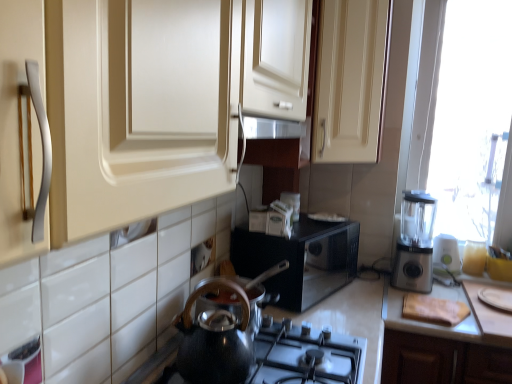
Describe the element at coordinates (447, 252) in the screenshot. The height and width of the screenshot is (384, 512). I see `white plastic blender at right, which is counted as the second appliance, starting from the left` at that location.

Image resolution: width=512 pixels, height=384 pixels. In order to click on shiny black kettle at lower center in this screenshot , I will do `click(305, 356)`.

The image size is (512, 384). What do you see at coordinates (415, 243) in the screenshot?
I see `silver metallic blender at right` at bounding box center [415, 243].

In order to face black glossy kettle at lower center, should I rotate leftwards or rightwards?

You should look left and rotate roughly 5.589 degrees.

What is the approximate width of white matte cutting board at right?

white matte cutting board at right is 21.04 inches in width.

This screenshot has width=512, height=384. I want to click on white plastic blender at right, which is counted as the second appliance, starting from the left, so click(447, 252).

From a real-world perspective, is matte cream cabinet at upper center beneath white plastic blender at right, which is counted as the second appliance, starting from the left?

No.

Between matte cream cabinet at upper center and white plastic blender at right, which is counted as the second appliance, starting from the left, which one appears on the right side from the viewer's perspective?

white plastic blender at right, which is counted as the second appliance, starting from the left, is more to the right.

Can you confirm if matte cream cabinet at upper center is taller than white plastic blender at right, which is counted as the second appliance, starting from the left?

Yes.

Is matte cream cabinet at upper center thinner than white plastic plate at lower right, acting as the 1th appliance starting from the right?

No, matte cream cabinet at upper center is not thinner than white plastic plate at lower right, acting as the 1th appliance starting from the right.

Would you say matte cream cabinet at upper center is inside or outside white plastic plate at lower right, acting as the 1th appliance starting from the right?

The correct answer is: outside.

Which of these two, matte cream cabinet at upper center or white plastic plate at lower right, acting as the 1th appliance starting from the right, stands shorter?

white plastic plate at lower right, acting as the 1th appliance starting from the right, is shorter.

Find the location of a particular element. Image resolution: width=512 pixels, height=384 pixels. cabinetry lying in front of the white plastic plate at lower right, acting as the 1th appliance starting from the right is located at coordinates (350, 80).

In terms of size, does white matte cutting board at right appear bigger or smaller than silver metallic blender at right?

Considering their sizes, white matte cutting board at right takes up more space than silver metallic blender at right.

Does white matte cutting board at right appear on the left side of silver metallic blender at right?

Incorrect, white matte cutting board at right is not on the left side of silver metallic blender at right.

Which is farther, [384,293] or [407,249]?

The point [407,249] is farther.

Is white matte cutting board at right not inside silver metallic blender at right?

Indeed, white matte cutting board at right is completely outside silver metallic blender at right.

Where is `the 1st appliance above the white plastic plate at lower right, which appears as the 3th appliance when viewed from the left (from a real-world perspective)`? the 1st appliance above the white plastic plate at lower right, which appears as the 3th appliance when viewed from the left (from a real-world perspective) is located at coordinates (447, 252).

Considering the sizes of objects white plastic blender at right, the second appliance from the right, and white plastic plate at lower right, acting as the 1th appliance starting from the right, in the image provided, who is wider, white plastic blender at right, the second appliance from the right, or white plastic plate at lower right, acting as the 1th appliance starting from the right,?

white plastic plate at lower right, acting as the 1th appliance starting from the right, is wider.

Is white plastic blender at right, which is counted as the second appliance, starting from the left, aimed at white plastic plate at lower right, acting as the 1th appliance starting from the right?

No, white plastic blender at right, which is counted as the second appliance, starting from the left, is not turned towards white plastic plate at lower right, acting as the 1th appliance starting from the right.

Is black glossy microwave at center, the 1th appliance from the left, positioned far away from silver metallic blender at right?

black glossy microwave at center, the 1th appliance from the left, is near silver metallic blender at right, not far away.

Based on the photo, from the image's perspective, who appears lower, black glossy microwave at center, the 1th appliance from the left, or silver metallic blender at right?

black glossy microwave at center, the 1th appliance from the left, appears lower in the image.

Would you say silver metallic blender at right is part of black glossy microwave at center, the 1th appliance from the left,'s contents?

No, silver metallic blender at right is not inside black glossy microwave at center, the 1th appliance from the left.

Which is more to the right, silver metallic blender at right or shiny black kettle at lower center?

Positioned to the right is silver metallic blender at right.

Is silver metallic blender at right placed right next to shiny black kettle at lower center?

There is a gap between silver metallic blender at right and shiny black kettle at lower center.

Is silver metallic blender at right thinner than shiny black kettle at lower center?

Yes, silver metallic blender at right is thinner than shiny black kettle at lower center.

What's the angular difference between silver metallic blender at right and shiny black kettle at lower center's facing directions?

There is a 90-degree angle between the facing directions of silver metallic blender at right and shiny black kettle at lower center.

Based on the photo, looking at the image, does white plastic plate at lower right, acting as the 1th appliance starting from the right, seem bigger or smaller compared to white matte cutting board at right?

In the image, white plastic plate at lower right, acting as the 1th appliance starting from the right, appears to be smaller than white matte cutting board at right.

Which of these two, white plastic plate at lower right, acting as the 1th appliance starting from the right, or white matte cutting board at right, is thinner?

Thinner between the two is white plastic plate at lower right, acting as the 1th appliance starting from the right.

From a real-world perspective, between white plastic plate at lower right, acting as the 1th appliance starting from the right, and white matte cutting board at right, who is vertically higher?

From a 3D spatial view, white plastic plate at lower right, acting as the 1th appliance starting from the right, is above.

Locate an element on the screen. This screenshot has width=512, height=384. cabinetry in front of the white plastic blender at right, the second appliance from the right is located at coordinates pos(350,80).

I want to click on cabinetry above the white plastic plate at lower right, acting as the 1th appliance starting from the right (from the image's perspective), so click(350, 80).

When comparing their distances from white plastic blender at right, which is counted as the second appliance, starting from the left, does matte cream cabinet at upper center or silver metallic blender at right seem closer?

Among the two, silver metallic blender at right is located nearer to white plastic blender at right, which is counted as the second appliance, starting from the left.

Estimate the real-world distances between objects in this image. Which object is closer to black glossy kettle at lower center, silver metallic blender at right or white plastic plate at lower right, acting as the 1th appliance starting from the right?

silver metallic blender at right.

Based on their spatial positions, is matte cream cabinet at upper center or white plastic plate at lower right, acting as the 1th appliance starting from the right, further from shiny black kettle at lower center?

white plastic plate at lower right, acting as the 1th appliance starting from the right, is further to shiny black kettle at lower center.

Considering their positions, is matte cream cabinet at upper center positioned closer to white plastic plate at lower right, acting as the 1th appliance starting from the right, than black glossy kettle at lower center?

Based on the image, matte cream cabinet at upper center appears to be nearer to white plastic plate at lower right, acting as the 1th appliance starting from the right.

Looking at the image, which one is located closer to white plastic plate at lower right, which appears as the 3th appliance when viewed from the left, white matte cutting board at right or silver metallic blender at right?

white matte cutting board at right is positioned closer to the anchor white plastic plate at lower right, which appears as the 3th appliance when viewed from the left.

Considering their positions, is shiny black kettle at lower center positioned further to matte cream cabinet at upper center than black glossy kettle at lower center?

black glossy kettle at lower center lies further to matte cream cabinet at upper center than the other object.

Considering their positions, is white plastic blender at right, which is counted as the second appliance, starting from the left, positioned closer to white matte cutting board at right than black glossy microwave at center, the 1th appliance from the left?

black glossy microwave at center, the 1th appliance from the left.

Which object lies nearer to the anchor point white plastic plate at lower right, which appears as the 3th appliance when viewed from the left, silver metallic blender at right or black glossy kettle at lower center?

silver metallic blender at right is positioned closer to the anchor white plastic plate at lower right, which appears as the 3th appliance when viewed from the left.

You are a GUI agent. You are given a task and a screenshot of the screen. Output one action in this format:
    pyautogui.click(x=<x>, y=<y>)
    Task: Click on the kitchen appliance between black glossy kettle at lower center and white matte cutting board at right in the horizontal direction
    Image resolution: width=512 pixels, height=384 pixels.
    Given the screenshot: What is the action you would take?
    pyautogui.click(x=415, y=243)

Locate an element on the screen. This screenshot has height=384, width=512. kettle between matte cream cabinet at upper center and shiny black kettle at lower center in the vertical direction is located at coordinates (216, 337).

Locate an element on the screen. This screenshot has height=384, width=512. appliance between black glossy microwave at center, the 1th appliance from the left, and white plastic plate at lower right, acting as the 1th appliance starting from the right, in the horizontal direction is located at coordinates (447, 252).

What are the coordinates of `appliance between matte cream cabinet at upper center and white plastic blender at right, which is counted as the second appliance, starting from the left, from top to bottom` in the screenshot? It's located at (300, 260).